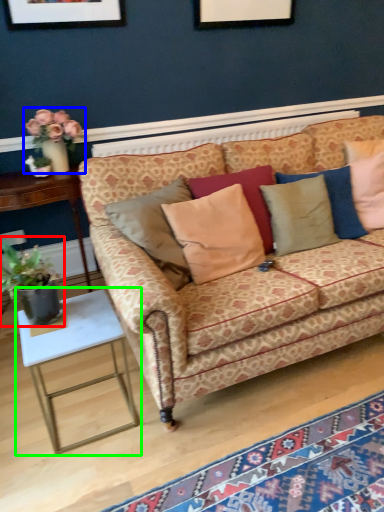
Question: Which object is positioned closest to houseplant (highlighted by a red box)? Select from floral arrangement (highlighted by a blue box) and table (highlighted by a green box).

Choices:
 (A) floral arrangement
 (B) table

Answer: (B)